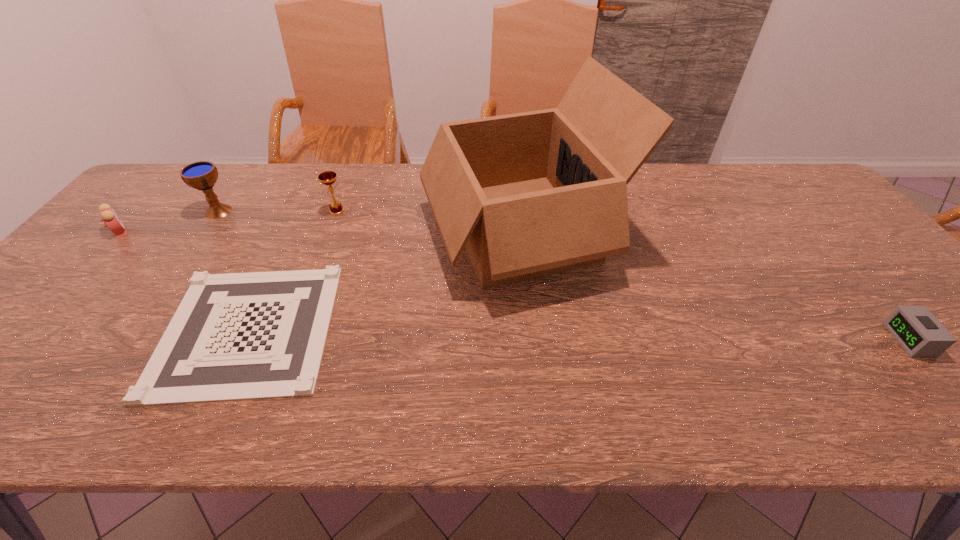
The image size is (960, 540). Identify the location of object that is positioned at the near edge. (236, 336).

At what (x,y) coordinates should I click in order to perform the action: click on object that is positioned at the left edge. Please return your answer as a coordinate pair (x, y). This screenshot has width=960, height=540. Looking at the image, I should click on (109, 217).

Find the location of a particular element. object at the right edge is located at coordinates (916, 329).

Locate an element on the screen. vacant space at the far edge of the desktop is located at coordinates (380, 193).

I want to click on vacant area at the near edge of the desktop, so click(762, 424).

You are a GUI agent. You are given a task and a screenshot of the screen. Output one action in this format:
    pyautogui.click(x=<x>, y=<y>)
    Task: Click on the free location at the left edge of the desktop
    Image resolution: width=960 pixels, height=540 pixels.
    Given the screenshot: What is the action you would take?
    pyautogui.click(x=121, y=242)

In the image, there is a desktop. Identify the location of vacant region at the right edge. The image size is (960, 540). pyautogui.click(x=845, y=239).

Where is `vacant region at the far left corner of the desktop`? vacant region at the far left corner of the desktop is located at coordinates pyautogui.click(x=179, y=167).

At what (x,y) coordinates should I click in order to perform the action: click on vacant area at the far right corner. Please return your answer as a coordinate pair (x, y). Image resolution: width=960 pixels, height=540 pixels. Looking at the image, I should click on (763, 179).

Image resolution: width=960 pixels, height=540 pixels. Find the location of `free space between the rightmost object and the second object from right to left`. free space between the rightmost object and the second object from right to left is located at coordinates (714, 285).